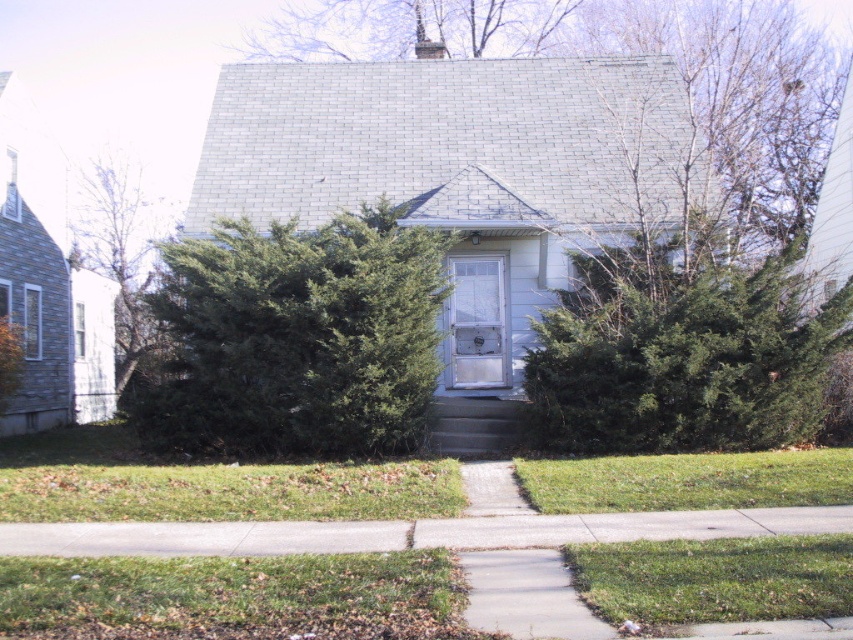
Question: Which object is the closest to the green textured bush at center?

Choices:
 (A) green leafy tree at left
 (B) green leafy bush at center
 (C) bare branches at upper center

Answer: (B)

Question: Can you confirm if bare branches at upper center is smaller than green leafy tree at left?

Choices:
 (A) no
 (B) yes

Answer: (A)

Question: Does green leafy bush at center appear over green textured bush at center?

Choices:
 (A) yes
 (B) no

Answer: (A)

Question: Based on their relative distances, which object is nearer to the green leafy tree at left?

Choices:
 (A) white plastic door at center
 (B) bare branches at upper center

Answer: (B)

Question: Considering the real-world distances, which object is farthest from the green leafy bush at center?

Choices:
 (A) bare branches at upper center
 (B) green textured bush at center

Answer: (A)

Question: Can you confirm if bare branches at upper center is positioned to the right of green leafy tree at left?

Choices:
 (A) yes
 (B) no

Answer: (A)